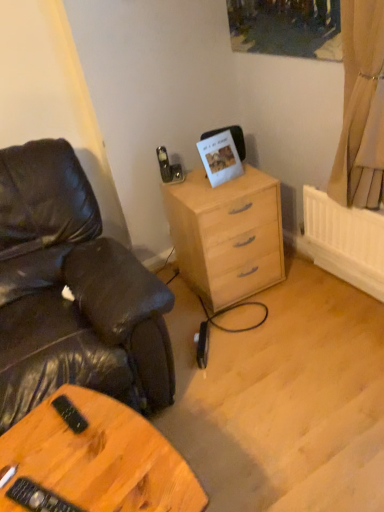
What is the approximate width of beige fabric curtain at upper right?

beige fabric curtain at upper right is 8.33 inches in width.

The width and height of the screenshot is (384, 512). What do you see at coordinates (226, 234) in the screenshot?
I see `light wood/finish chest of drawers at center` at bounding box center [226, 234].

The height and width of the screenshot is (512, 384). In order to click on wooden table at lower left in this screenshot , I will do `click(92, 460)`.

Measure the distance between point (114,345) and camera.

The distance of point (114,345) from camera is 4.50 feet.

This screenshot has width=384, height=512. Describe the element at coordinates (72, 292) in the screenshot. I see `black leather chair at left` at that location.

Locate an element on the screen. beige fabric curtain at upper right is located at coordinates (361, 108).

How many degrees apart are the facing directions of wooden table at lower left and beige fabric curtain at upper right?

The angle between the facing direction of wooden table at lower left and the facing direction of beige fabric curtain at upper right is 74.7 degrees.

Is wooden table at lower left aimed at beige fabric curtain at upper right?

No, wooden table at lower left is not oriented towards beige fabric curtain at upper right.

Are wooden table at lower left and beige fabric curtain at upper right located far from each other?

Absolutely, wooden table at lower left is distant from beige fabric curtain at upper right.

From the image's perspective, would you say wooden table at lower left is shown under light wood/finish chest of drawers at center?

Indeed, from the image's perspective, wooden table at lower left is shown beneath light wood/finish chest of drawers at center.

Where is `desk in front of the light wood/finish chest of drawers at center`? Image resolution: width=384 pixels, height=512 pixels. desk in front of the light wood/finish chest of drawers at center is located at coordinates (92, 460).

Is wooden table at lower left touching light wood/finish chest of drawers at center?

No.

Who is bigger, wooden table at lower left or light wood/finish chest of drawers at center?

Bigger between the two is light wood/finish chest of drawers at center.

Does point (195, 227) come closer to viewer compared to point (121, 470)?

No, it is behind (121, 470).

Is light wood/finish chest of drawers at center not near wooden table at lower left?

Yes, light wood/finish chest of drawers at center and wooden table at lower left are quite far apart.

Find the location of a particular element. desk in front of the light wood/finish chest of drawers at center is located at coordinates (92, 460).

Is light wood/finish chest of drawers at center closer to camera compared to wooden table at lower left?

No.

Is wooden table at lower left completely or partially inside beige fabric curtain at upper right?

No.

Considering the relative sizes of beige fabric curtain at upper right and wooden table at lower left in the image provided, is beige fabric curtain at upper right smaller than wooden table at lower left?

Correct, beige fabric curtain at upper right occupies less space than wooden table at lower left.

Is beige fabric curtain at upper right facing away from wooden table at lower left?

No, beige fabric curtain at upper right is not facing the opposite direction of wooden table at lower left.

Does beige fabric curtain at upper right have a lesser height compared to wooden table at lower left?

No.

Is light wood/finish chest of drawers at center turned away from black leather chair at left?

light wood/finish chest of drawers at center does not have its back to black leather chair at left.

Does light wood/finish chest of drawers at center have a greater height compared to black leather chair at left?

No.

The image size is (384, 512). What are the coordinates of `chair below the light wood/finish chest of drawers at center (from the image's perspective)` in the screenshot? It's located at (72, 292).

Is light wood/finish chest of drawers at center not within black leather chair at left?

Indeed, light wood/finish chest of drawers at center is completely outside black leather chair at left.

Is beige fabric curtain at upper right further to camera compared to black leather chair at left?

Yes, beige fabric curtain at upper right is behind black leather chair at left.

Who is taller, beige fabric curtain at upper right or black leather chair at left?

black leather chair at left is taller.

From the image's perspective, which object appears higher, beige fabric curtain at upper right or black leather chair at left?

beige fabric curtain at upper right appears higher in the image.

Is black leather chair at left oriented towards wooden table at lower left?

Yes, black leather chair at left is oriented towards wooden table at lower left.

Considering the sizes of black leather chair at left and wooden table at lower left in the image, is black leather chair at left wider or thinner than wooden table at lower left?

black leather chair at left is wider than wooden table at lower left.

Between black leather chair at left and wooden table at lower left, which one is positioned behind?

black leather chair at left is further from the camera.

Do you think black leather chair at left is within wooden table at lower left, or outside of it?

black leather chair at left is located beyond the bounds of wooden table at lower left.

Locate an element on the screen. Image resolution: width=384 pixels, height=512 pixels. curtain lying on the right of wooden table at lower left is located at coordinates (361, 108).

Find the location of a particular element. The height and width of the screenshot is (512, 384). the chest of drawers above the wooden table at lower left (from the image's perspective) is located at coordinates (226, 234).

Which object lies further to the anchor point beige fabric curtain at upper right, light wood/finish chest of drawers at center or black leather chair at left?

Among the two, black leather chair at left is located further to beige fabric curtain at upper right.

When comparing their distances from wooden table at lower left, does light wood/finish chest of drawers at center or black leather chair at left seem further?

Among the two, light wood/finish chest of drawers at center is located further to wooden table at lower left.

Looking at this image, based on their spatial positions, is beige fabric curtain at upper right or light wood/finish chest of drawers at center closer to black leather chair at left?

Based on the image, light wood/finish chest of drawers at center appears to be nearer to black leather chair at left.

Which object lies nearer to the anchor point black leather chair at left, wooden table at lower left or beige fabric curtain at upper right?

wooden table at lower left lies closer to black leather chair at left than the other object.

When comparing their distances from light wood/finish chest of drawers at center, does wooden table at lower left or black leather chair at left seem further?

Among the two, wooden table at lower left is located further to light wood/finish chest of drawers at center.

From the image, which object appears to be nearer to black leather chair at left, light wood/finish chest of drawers at center or wooden table at lower left?

wooden table at lower left is positioned closer to the anchor black leather chair at left.

In the scene shown: Considering their positions, is beige fabric curtain at upper right positioned closer to wooden table at lower left than light wood/finish chest of drawers at center?

Among the two, light wood/finish chest of drawers at center is located nearer to wooden table at lower left.

Based on their spatial positions, is wooden table at lower left or light wood/finish chest of drawers at center closer to beige fabric curtain at upper right?

Among the two, light wood/finish chest of drawers at center is located nearer to beige fabric curtain at upper right.

Identify the location of the chest of drawers located between black leather chair at left and beige fabric curtain at upper right in the left-right direction. (226, 234).

Find the location of a particular element. This screenshot has width=384, height=512. chest of drawers between beige fabric curtain at upper right and wooden table at lower left in the up-down direction is located at coordinates (226, 234).

You are a GUI agent. You are given a task and a screenshot of the screen. Output one action in this format:
    pyautogui.click(x=<x>, y=<y>)
    Task: Click on the chair between wooden table at lower left and light wood/finish chest of drawers at center along the z-axis
    The height and width of the screenshot is (512, 384).
    Given the screenshot: What is the action you would take?
    pyautogui.click(x=72, y=292)

Locate an element on the screen. The width and height of the screenshot is (384, 512). chair between beige fabric curtain at upper right and wooden table at lower left from top to bottom is located at coordinates (72, 292).